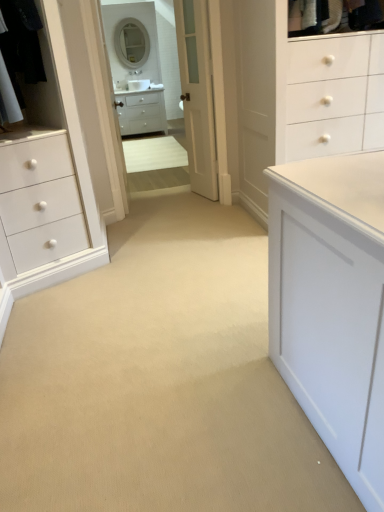
Question: From a real-world perspective, is white glossy mirror at upper center, the second mirror in the top-to-bottom sequence, below white glossy cabinet at center?

Choices:
 (A) yes
 (B) no

Answer: (B)

Question: From a real-world perspective, does white glossy mirror at upper center, which is the 1th mirror from bottom to top, stand above white glossy cabinet at center?

Choices:
 (A) no
 (B) yes

Answer: (B)

Question: Does white glossy mirror at upper center, which is the 1th mirror from bottom to top, have a larger size compared to white glossy cabinet at center?

Choices:
 (A) yes
 (B) no

Answer: (B)

Question: Is white glossy mirror at upper center, which is the 1th mirror from bottom to top, not close to white glossy cabinet at center?

Choices:
 (A) no
 (B) yes

Answer: (A)

Question: Does white glossy mirror at upper center, the second mirror in the top-to-bottom sequence, contain white glossy cabinet at center?

Choices:
 (A) yes
 (B) no

Answer: (B)

Question: Is white glossy mirror at upper center, which is the 1th mirror from bottom to top, thinner than white glossy cabinet at center?

Choices:
 (A) yes
 (B) no

Answer: (A)

Question: Is white wood door at center taller than white glossy mirror at upper center, which appears as the first mirror when viewed from the top?

Choices:
 (A) no
 (B) yes

Answer: (B)

Question: Is white wood door at center closer to the viewer compared to white glossy mirror at upper center, which is the second mirror in bottom-to-top order?

Choices:
 (A) yes
 (B) no

Answer: (A)

Question: From a real-world perspective, is white wood door at center over white glossy mirror at upper center, which is the second mirror in bottom-to-top order?

Choices:
 (A) yes
 (B) no

Answer: (B)

Question: From the image's perspective, is white wood door at center under white glossy mirror at upper center, which is the second mirror in bottom-to-top order?

Choices:
 (A) no
 (B) yes

Answer: (B)

Question: From a real-world perspective, is white wood door at center positioned under white glossy mirror at upper center, which appears as the first mirror when viewed from the top, based on gravity?

Choices:
 (A) no
 (B) yes

Answer: (B)

Question: Is white wood door at center positioned beyond the bounds of white glossy mirror at upper center, which appears as the first mirror when viewed from the top?

Choices:
 (A) yes
 (B) no

Answer: (A)

Question: From the image's perspective, is black fabric laundry at upper left located above white wood door at center?

Choices:
 (A) no
 (B) yes

Answer: (A)